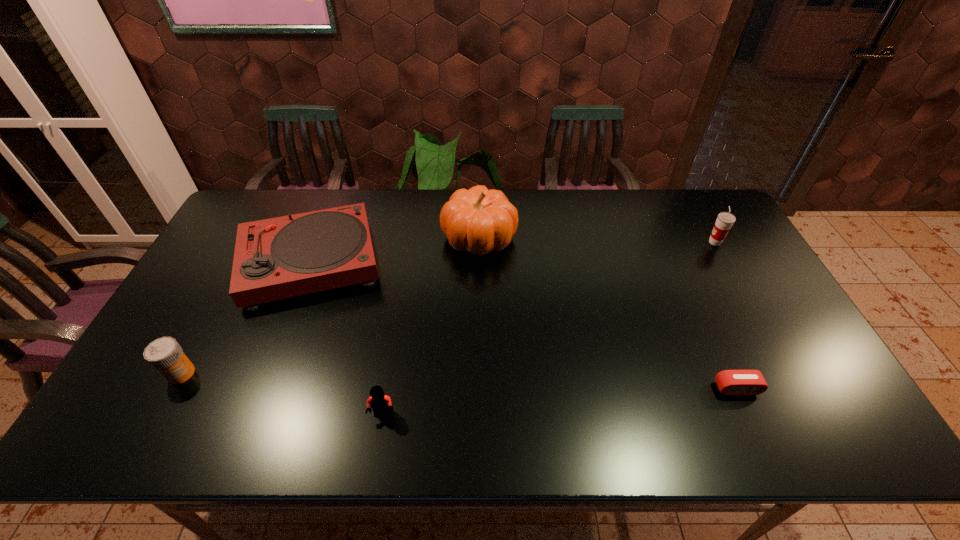
At what (x,y) coordinates should I click in order to perform the action: click on vacant space located 0.340m on the left of the third object from right to left. Please return your answer as a coordinate pair (x, y). Image resolution: width=960 pixels, height=540 pixels. Looking at the image, I should click on (339, 238).

This screenshot has height=540, width=960. What are the coordinates of `vacant region located on the side of the second tallest object with the logo` in the screenshot? It's located at (683, 242).

Image resolution: width=960 pixels, height=540 pixels. Identify the location of free space located 0.170m on the side of the second tallest object with the logo. (656, 242).

Locate an element on the screen. The width and height of the screenshot is (960, 540). free location located on the side of the second tallest object with the logo is located at coordinates (610, 242).

Where is `free region located 0.380m on the right of the record player`? free region located 0.380m on the right of the record player is located at coordinates (506, 262).

Image resolution: width=960 pixels, height=540 pixels. I want to click on vacant area located 0.070m on the label side of the medicine, so click(x=160, y=412).

Identify the location of free region located 0.050m on the front-facing side of the Lego. (378, 443).

Image resolution: width=960 pixels, height=540 pixels. I want to click on free space located on the front-facing side of the shortest object, so click(x=762, y=445).

You are a GUI agent. You are given a task and a screenshot of the screen. Output one action in this format:
    pyautogui.click(x=<x>, y=<y>)
    Task: Click on the pumpkin that is positioned at the far edge
    
    Given the screenshot: What is the action you would take?
    pyautogui.click(x=478, y=220)

You are a GUI agent. You are given a task and a screenshot of the screen. Output one action in this format:
    pyautogui.click(x=<x>, y=<y>)
    Task: Click on the record player present at the far edge
    The image size is (960, 540).
    Given the screenshot: What is the action you would take?
    pyautogui.click(x=283, y=257)